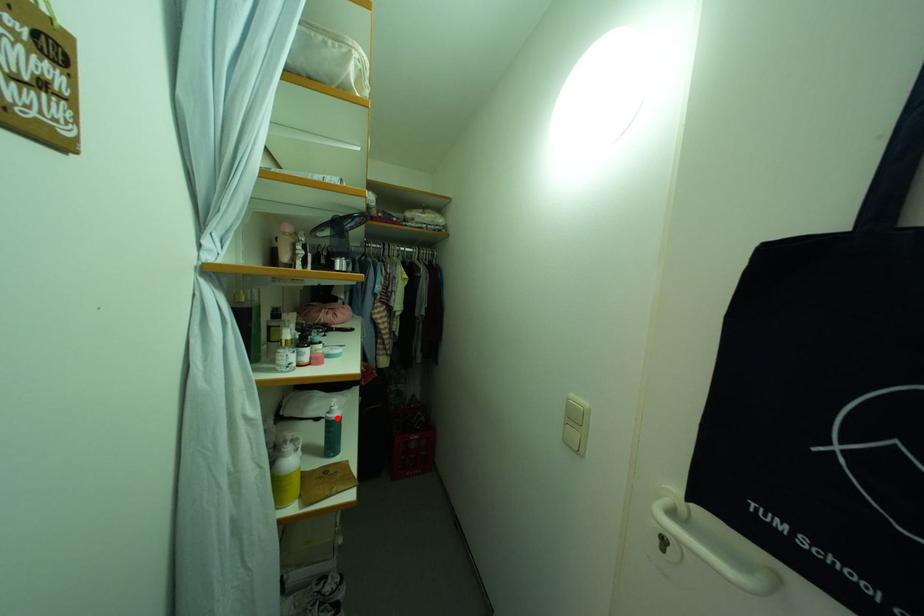
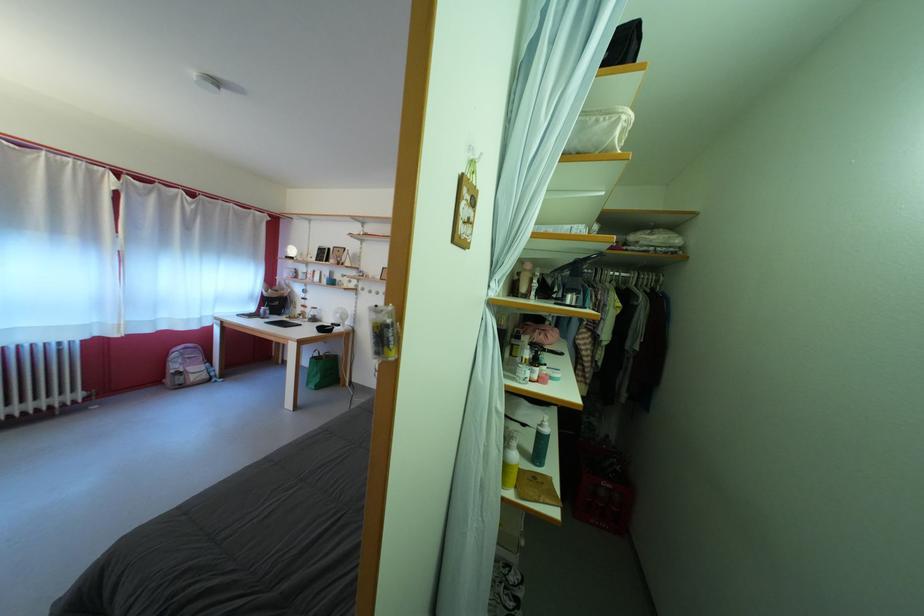
Question: I am providing you with two images of the same scene from different viewpoints. A red point is shown in image1. For the corresponding object point in image2, is it positioned nearer or farther from the camera?

Choices:
 (A) Nearer
 (B) Farther

Answer: (B)